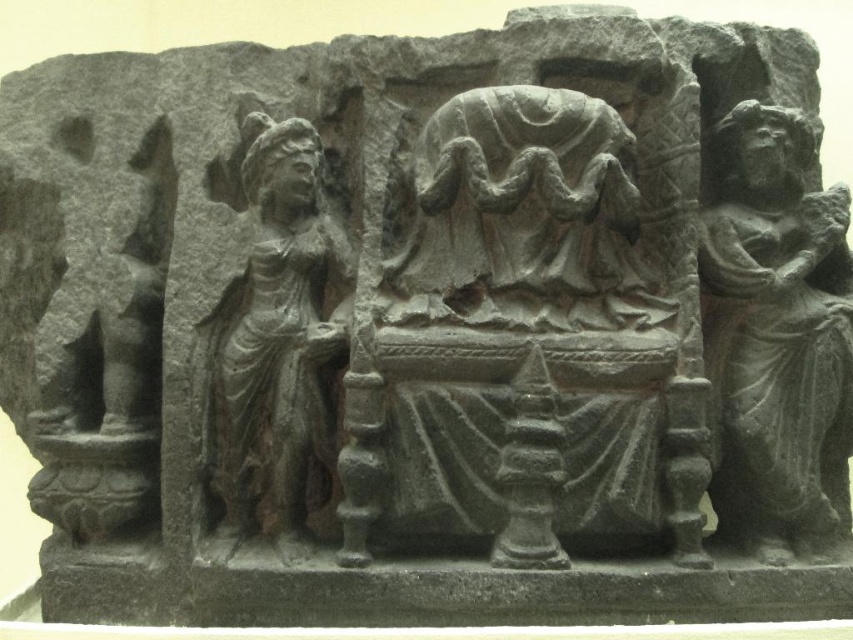
You are an archaeologist examining the stone relief sculpture. You notice the dark gray stone figure at right and the gray stone figure at center. Based on their positions, which figure is placed lower in the relief?

The dark gray stone figure at right is positioned under the gray stone figure at center, so it is placed lower in the relief.

You are an archaeologist examining the stone relief sculpture. You notice two figures carved into the stone relief sculpture. The first is the dark gray stone figure at right, and the second is the gray stone figure at center. From your perspective, which of these two figures is positioned more to the right side of the relief?

The dark gray stone figure at right is positioned more to the right side of the relief than the gray stone figure at center, as it is located to the right of it according to the description.